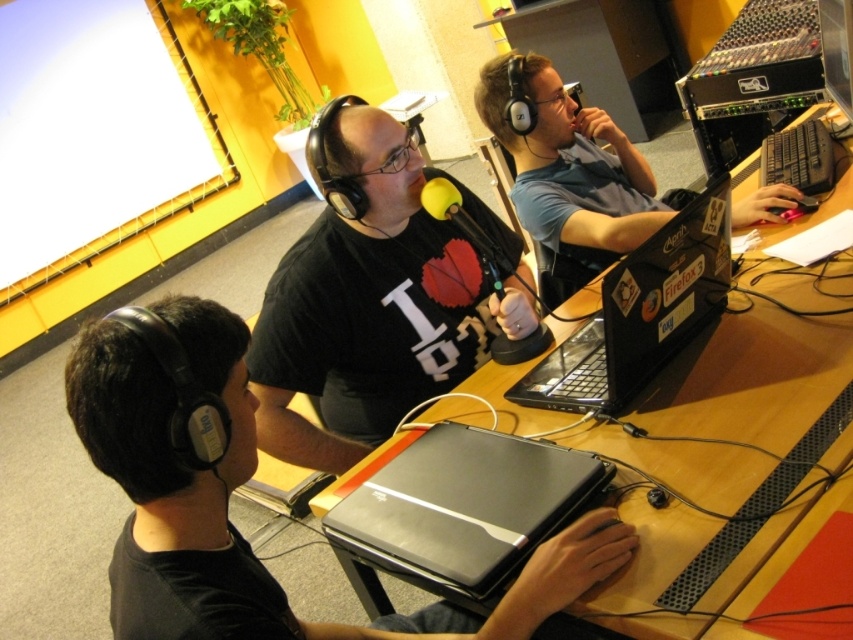
Based on the photo, is matte black t-shirt at center shorter than sleek black laptop at center?

Incorrect, matte black t-shirt at center's height does not fall short of sleek black laptop at center's.

Is matte black t-shirt at center wider than sleek black laptop at center?

Correct, the width of matte black t-shirt at center exceeds that of sleek black laptop at center.

This screenshot has width=853, height=640. In order to click on matte black t-shirt at center in this screenshot , I will do `click(370, 301)`.

Does black plastic table at center have a smaller size compared to black glossy laptop at center?

Incorrect, black plastic table at center is not smaller in size than black glossy laptop at center.

Does black plastic table at center have a larger size compared to black glossy laptop at center?

Indeed, black plastic table at center has a larger size compared to black glossy laptop at center.

Image resolution: width=853 pixels, height=640 pixels. Identify the location of black plastic table at center. (741, 380).

Can you confirm if black matte headphones at lower left is positioned to the left of matte black laptop at right?

Indeed, black matte headphones at lower left is positioned on the left side of matte black laptop at right.

Who is positioned more to the left, black matte headphones at lower left or matte black laptop at right?

black matte headphones at lower left is more to the left.

You are a GUI agent. You are given a task and a screenshot of the screen. Output one action in this format:
    pyautogui.click(x=<x>, y=<y>)
    Task: Click on the black matte headphones at lower left
    
    Given the screenshot: What is the action you would take?
    pyautogui.click(x=238, y=484)